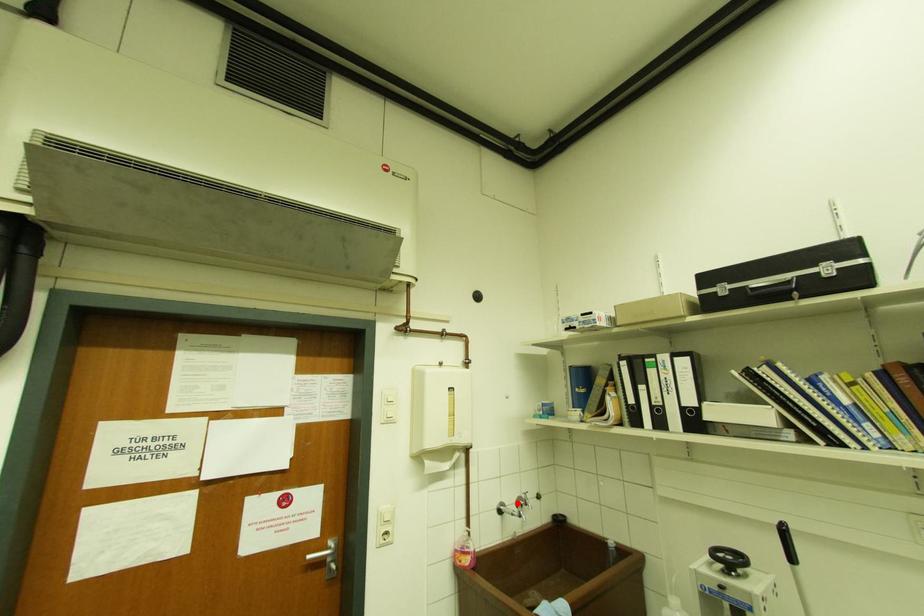
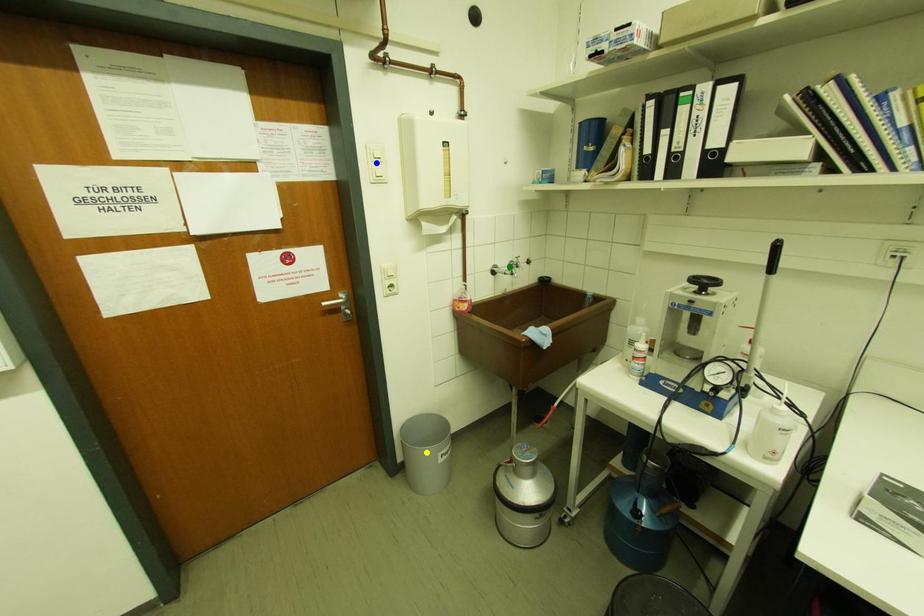
Question: I am providing you with two images of the same scene from different viewpoints. A red point is marked on the first image. You are given multiple points on the second image. Can you choose the point in image 2 that corresponds to the point in image 1?

Choices:
 (A) green point
 (B) blue point
 (C) yellow point

Answer: (A)